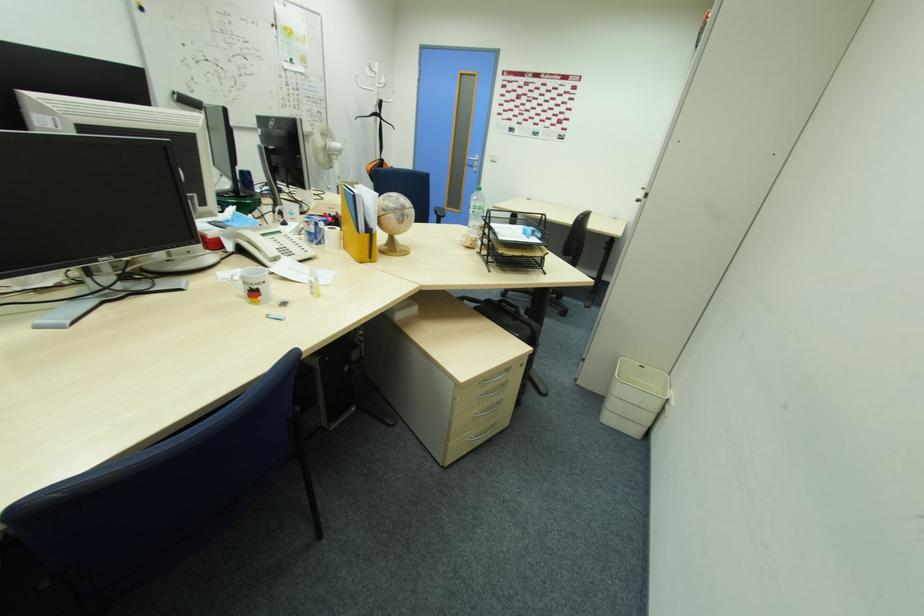
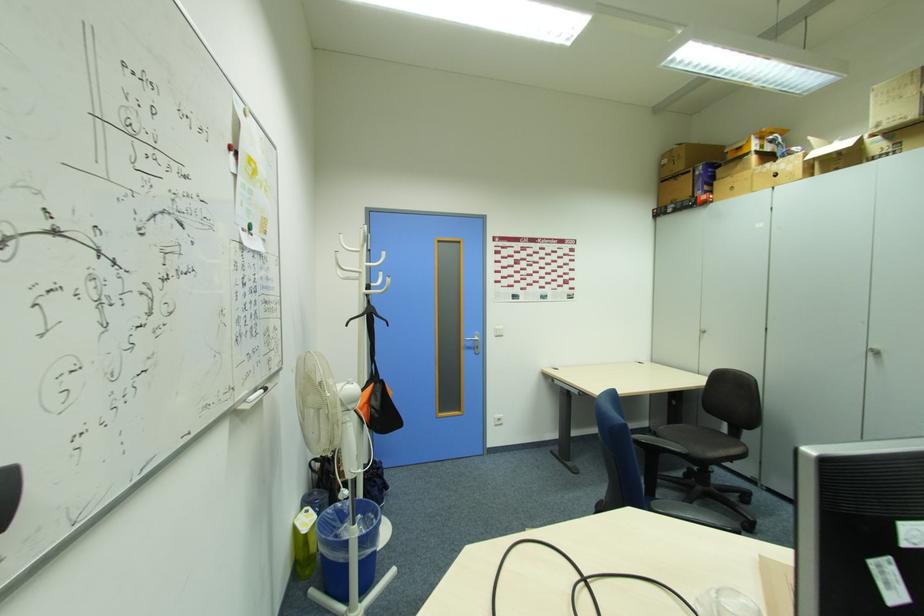
Where in the second image is the point corresponding to point (475, 164) from the first image?

(472, 346)